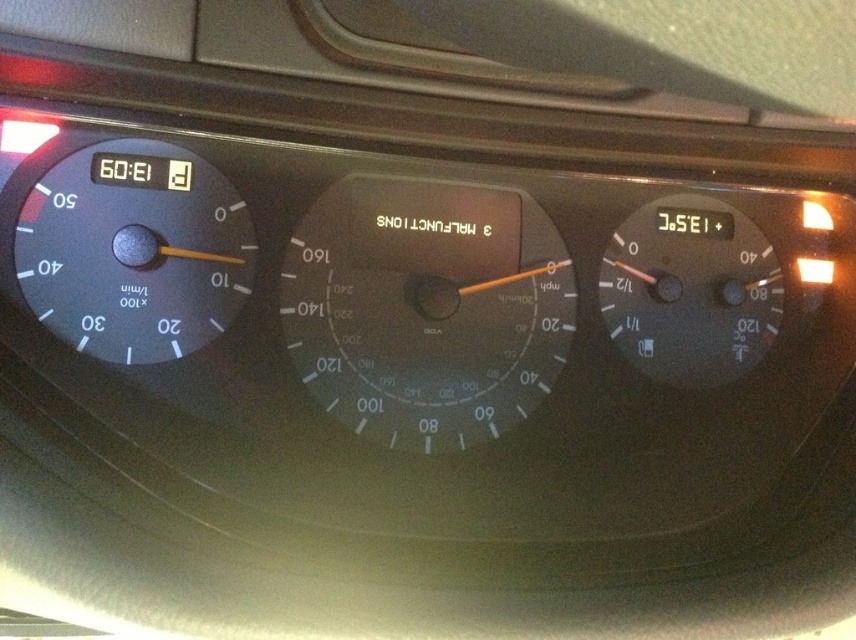
Does transparent glass speedometer at center appear on the right side of black plastic speedometer at left?

Yes, transparent glass speedometer at center is to the right of black plastic speedometer at left.

Does transparent glass speedometer at center appear under black plastic speedometer at left?

Yes.

Where is `transparent glass speedometer at center`? This screenshot has height=640, width=856. transparent glass speedometer at center is located at coordinates (426, 308).

Does transparent glass speedometer at center have a greater height compared to matte black speedometer at right?

Correct, transparent glass speedometer at center is much taller as matte black speedometer at right.

Which of these two, transparent glass speedometer at center or matte black speedometer at right, stands taller?

With more height is transparent glass speedometer at center.

You are a GUI agent. You are given a task and a screenshot of the screen. Output one action in this format:
    pyautogui.click(x=<x>, y=<y>)
    Task: Click on the transparent glass speedometer at center
    This screenshot has height=640, width=856.
    Given the screenshot: What is the action you would take?
    pyautogui.click(x=426, y=308)

The image size is (856, 640). Find the location of `black plastic speedometer at left`. black plastic speedometer at left is located at coordinates (134, 250).

Does black plastic speedometer at left have a lesser height compared to matte black speedometer at right?

In fact, black plastic speedometer at left may be taller than matte black speedometer at right.

Find the location of a particular element. The image size is (856, 640). black plastic speedometer at left is located at coordinates (134, 250).